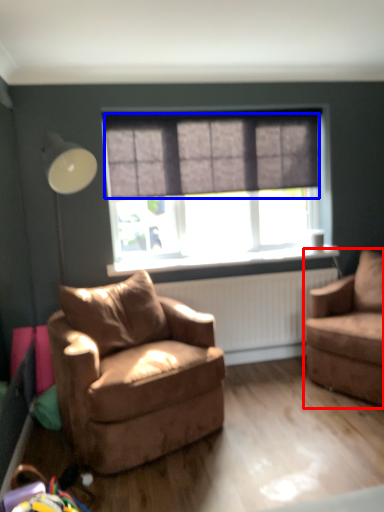
Question: Which object appears farthest to the camera in this image, chair (highlighted by a red box) or curtain (highlighted by a blue box)?

Choices:
 (A) chair
 (B) curtain

Answer: (B)